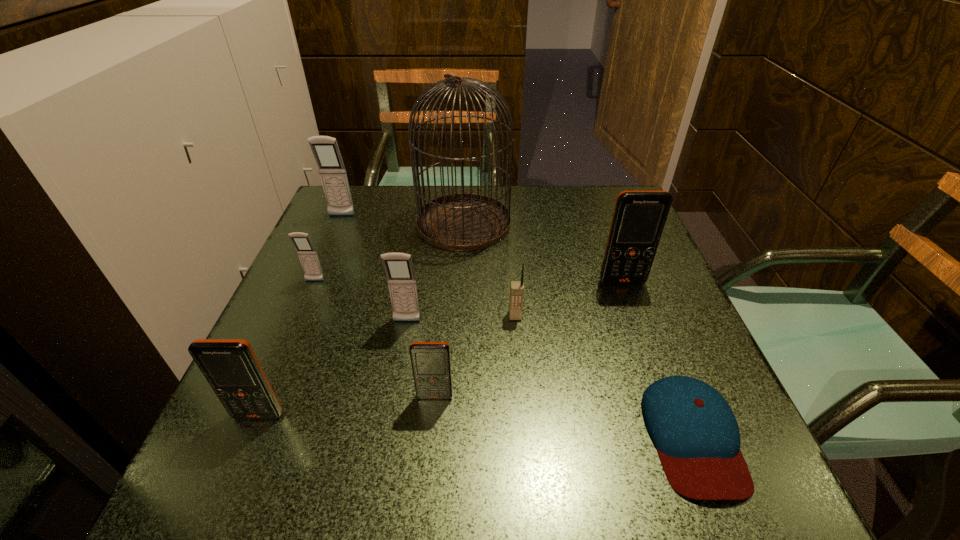
This screenshot has height=540, width=960. Find the location of `the tallest object`. the tallest object is located at coordinates (458, 222).

Locate an element on the screen. The height and width of the screenshot is (540, 960). the farthest gray cellular telephone is located at coordinates (325, 149).

Find the location of `the biggest gray cellular telephone`. the biggest gray cellular telephone is located at coordinates (325, 149).

Locate an element on the screen. Image resolution: width=960 pixels, height=540 pixels. the rightmost cellular telephone is located at coordinates (639, 217).

This screenshot has width=960, height=540. I want to click on the rightmost orange cellular telephone, so pos(639,217).

The height and width of the screenshot is (540, 960). In order to click on the second smallest gray cellular telephone in this screenshot , I will do `click(399, 269)`.

This screenshot has width=960, height=540. What are the coordinates of `the nearest gray cellular telephone` in the screenshot? It's located at (399, 269).

The height and width of the screenshot is (540, 960). Find the location of `the leftmost orange cellular telephone`. the leftmost orange cellular telephone is located at coordinates (230, 366).

The width and height of the screenshot is (960, 540). Find the location of `the nearest orange cellular telephone`. the nearest orange cellular telephone is located at coordinates (230, 366).

Identify the location of the second cellular telephone from right to left. (516, 287).